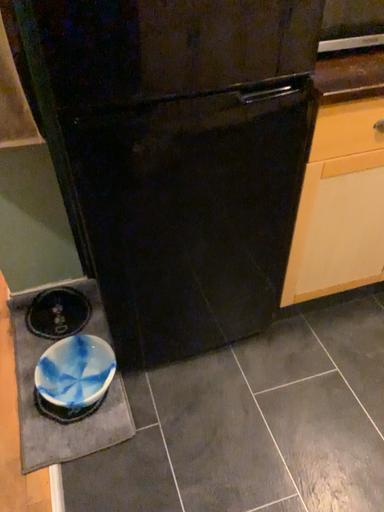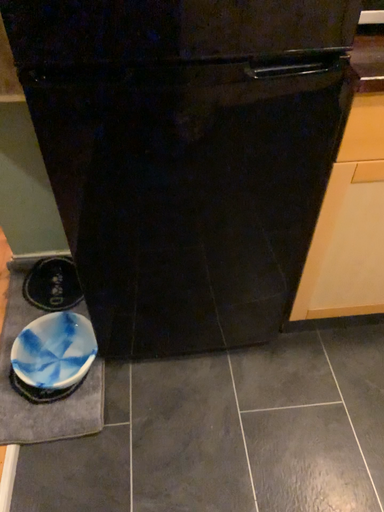
Question: How did the camera likely rotate when shooting the video?

Choices:
 (A) rotated right
 (B) rotated left

Answer: (B)